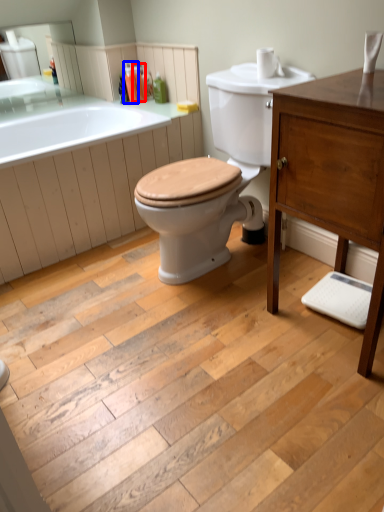
Question: Which point is further to the camera, toiletry (highlighted by a red box) or toiletry (highlighted by a blue box)?

Choices:
 (A) toiletry
 (B) toiletry

Answer: (A)